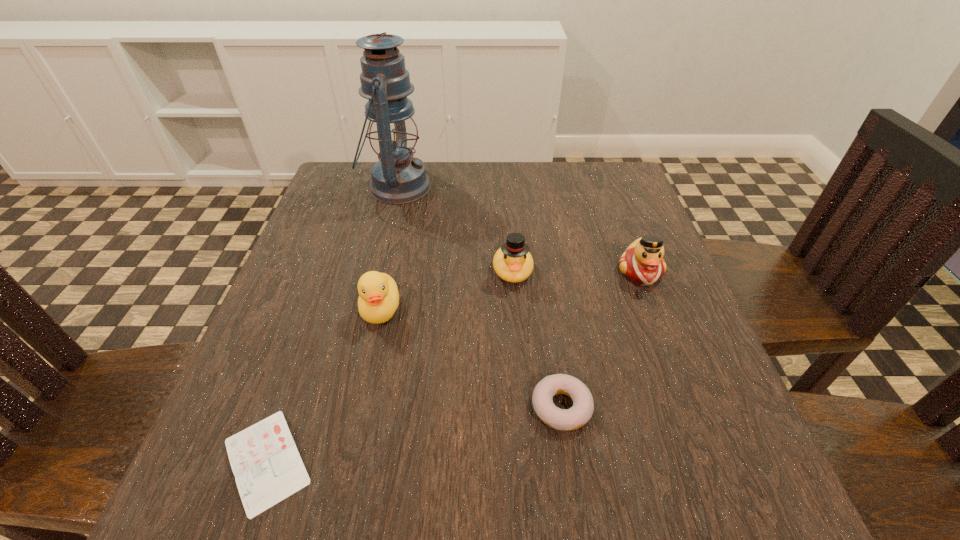
The image size is (960, 540). In order to click on blank space located 0.160m at the beak of the leftmost duck in this screenshot , I will do `click(358, 414)`.

Find the location of a particular element. Image resolution: width=960 pixels, height=540 pixels. free location located 0.110m on the back of the fifth tallest object is located at coordinates (550, 328).

The width and height of the screenshot is (960, 540). Identify the location of free space located 0.250m on the right of the diary. (494, 461).

Where is `object present at the far edge`? object present at the far edge is located at coordinates (398, 178).

This screenshot has width=960, height=540. I want to click on object that is at the near edge, so click(x=267, y=466).

Identify the location of lantern that is at the left edge. (398, 178).

What are the coordinates of `diary that is at the left edge` in the screenshot? It's located at (267, 466).

You are a GUI agent. You are given a task and a screenshot of the screen. Output one action in this format:
    pyautogui.click(x=<x>, y=<y>)
    Task: Click on the object positioned at the right edge
    Image resolution: width=960 pixels, height=540 pixels.
    Given the screenshot: What is the action you would take?
    pyautogui.click(x=642, y=263)

You are a GUI agent. You are given a task and a screenshot of the screen. Output one action in this format:
    pyautogui.click(x=<x>, y=<y>)
    Task: Click on the object situated at the far left corner
    This screenshot has width=960, height=540.
    Given the screenshot: What is the action you would take?
    pyautogui.click(x=398, y=178)

In order to click on object at the near left corner in this screenshot , I will do 267,466.